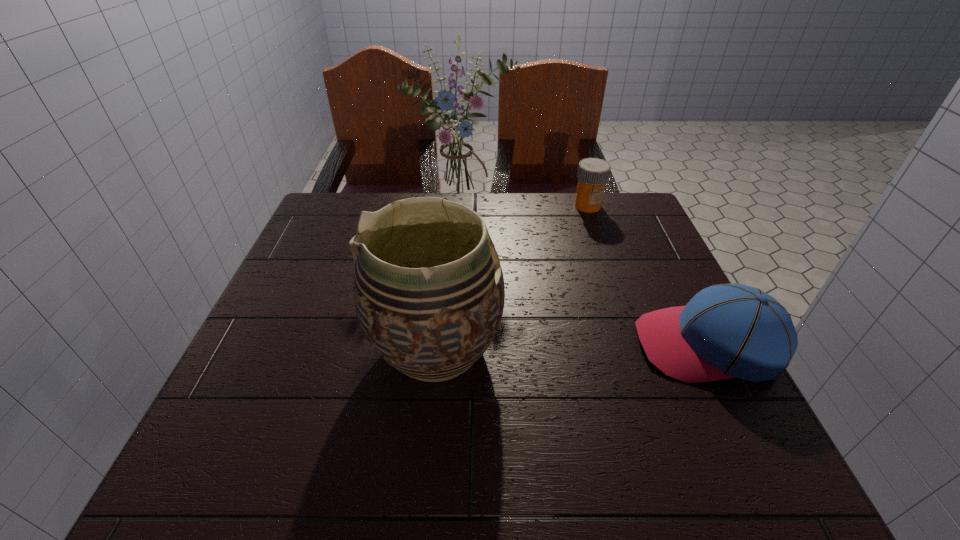
Where is `vacant space that's between the tallest object and the medicine`? vacant space that's between the tallest object and the medicine is located at coordinates (524, 208).

Locate an element on the screen. The image size is (960, 540). vacant point located between the second tallest object and the baseball cap is located at coordinates (572, 347).

Where is `vacant area between the tallest object and the baseball cap`? vacant area between the tallest object and the baseball cap is located at coordinates (585, 277).

The image size is (960, 540). Identify the location of object that is the third closest to the baseball cap. (593, 173).

At what (x,y) coordinates should I click in order to perform the action: click on the closest object to the third shortest object. Please return your answer as a coordinate pair (x, y). The width and height of the screenshot is (960, 540). Looking at the image, I should click on (725, 331).

Find the location of a particular element. The image size is (960, 540). free region that satisfies the following two spatial constraints: 1. on the back side of the baseball cap; 2. on the front-facing side of the second tallest object is located at coordinates (437, 345).

Where is `free location that satisfies the following two spatial constraints: 1. on the front side of the baseball cap; 2. on the front-facing side of the medicine`? Image resolution: width=960 pixels, height=540 pixels. free location that satisfies the following two spatial constraints: 1. on the front side of the baseball cap; 2. on the front-facing side of the medicine is located at coordinates (636, 345).

The width and height of the screenshot is (960, 540). Find the location of `free space in the image that satisfies the following two spatial constraints: 1. on the back side of the tallest object; 2. on the left side of the pottery`. free space in the image that satisfies the following two spatial constraints: 1. on the back side of the tallest object; 2. on the left side of the pottery is located at coordinates (449, 210).

The width and height of the screenshot is (960, 540). Find the location of `free space that satisfies the following two spatial constraints: 1. on the back side of the pottery; 2. on the front-facing side of the baseball cap`. free space that satisfies the following two spatial constraints: 1. on the back side of the pottery; 2. on the front-facing side of the baseball cap is located at coordinates [437, 345].

This screenshot has height=540, width=960. I want to click on vacant area in the image that satisfies the following two spatial constraints: 1. on the back side of the medicine; 2. on the right side of the second tallest object, so click(450, 206).